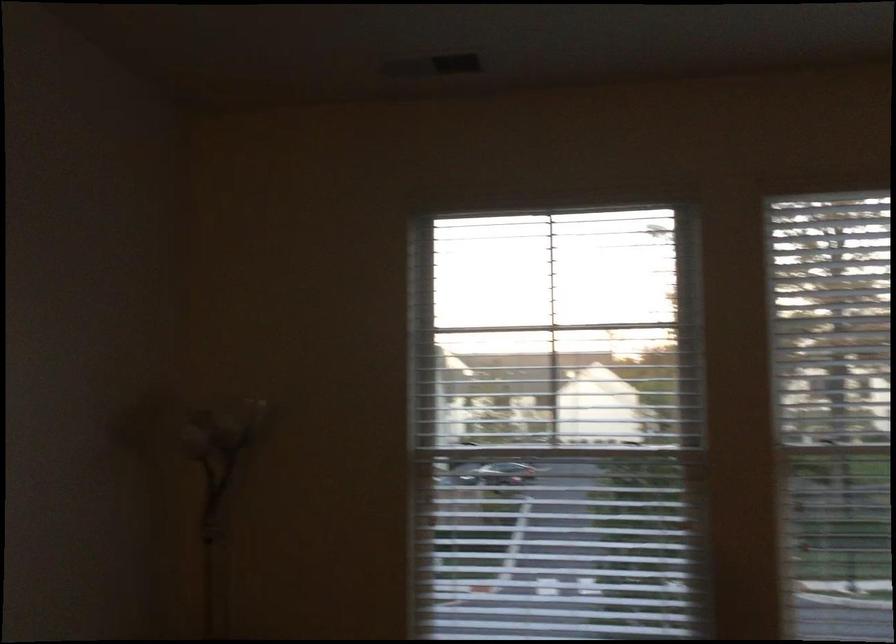
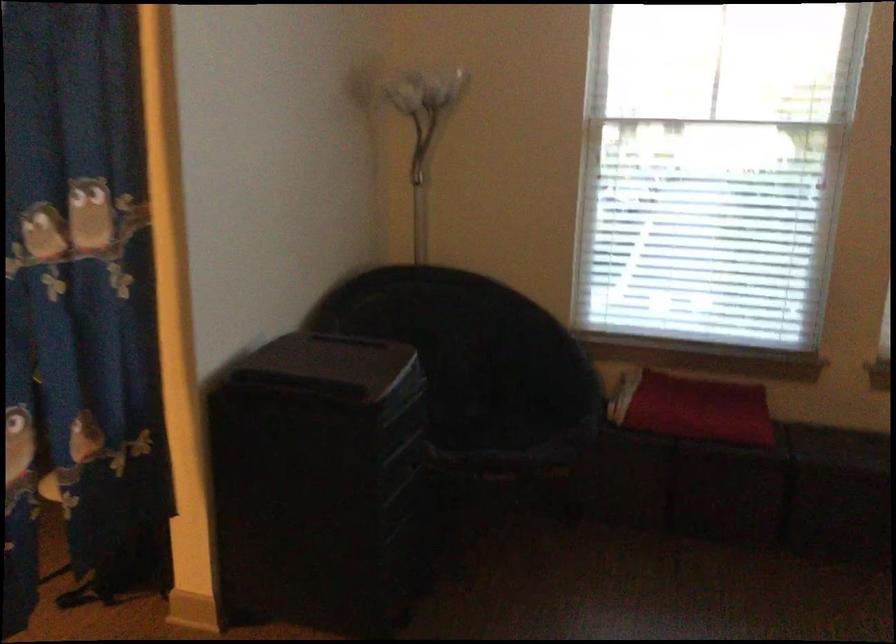
Question: The images are taken continuously from a first-person perspective. In which direction are you moving?

Choices:
 (A) Left
 (B) Right
 (C) Forward
 (D) Backward

Answer: (D)